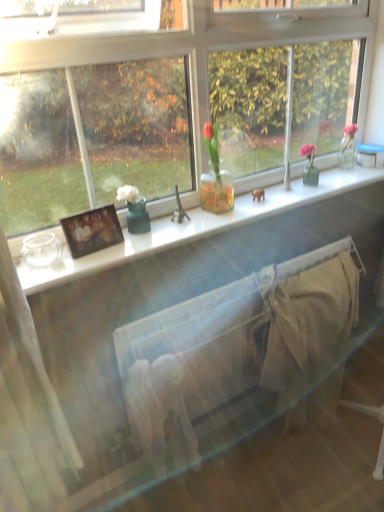
Where is `empty space that is to the right of matte wooden picture frame at left`? This screenshot has height=512, width=384. empty space that is to the right of matte wooden picture frame at left is located at coordinates (144, 242).